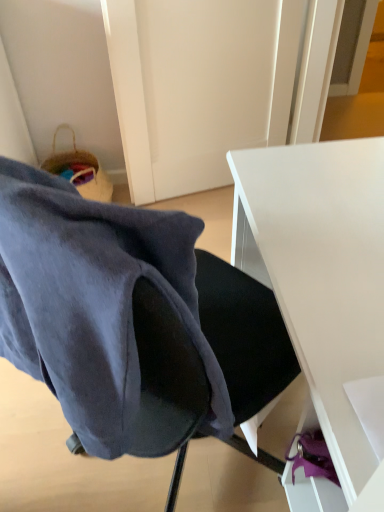
Question: Can you confirm if white matte desk at center is thinner than velvet dark blue chair at center?

Choices:
 (A) yes
 (B) no

Answer: (B)

Question: Would you say white matte desk at center is a long distance from velvet dark blue chair at center?

Choices:
 (A) no
 (B) yes

Answer: (A)

Question: Is white matte desk at center behind velvet dark blue chair at center?

Choices:
 (A) yes
 (B) no

Answer: (A)

Question: Does white matte desk at center turn towards velvet dark blue chair at center?

Choices:
 (A) yes
 (B) no

Answer: (A)

Question: Is white matte desk at center smaller than velvet dark blue chair at center?

Choices:
 (A) yes
 (B) no

Answer: (B)

Question: Considering the relative sizes of white matte desk at center and velvet dark blue chair at center in the image provided, is white matte desk at center wider than velvet dark blue chair at center?

Choices:
 (A) yes
 (B) no

Answer: (A)

Question: Considering the relative positions of velvet dark blue chair at center and white matte desk at center in the image provided, is velvet dark blue chair at center in front of white matte desk at center?

Choices:
 (A) no
 (B) yes

Answer: (B)

Question: From a real-world perspective, is velvet dark blue chair at center physically below white matte desk at center?

Choices:
 (A) yes
 (B) no

Answer: (B)

Question: Does velvet dark blue chair at center lie behind white matte desk at center?

Choices:
 (A) no
 (B) yes

Answer: (A)

Question: Can you confirm if velvet dark blue chair at center is taller than white matte desk at center?

Choices:
 (A) yes
 (B) no

Answer: (B)

Question: From the image's perspective, is velvet dark blue chair at center below white matte desk at center?

Choices:
 (A) yes
 (B) no

Answer: (B)

Question: Is velvet dark blue chair at center outside of white matte desk at center?

Choices:
 (A) yes
 (B) no

Answer: (A)

Question: In terms of width, does velvet dark blue chair at center look wider or thinner when compared to white matte desk at center?

Choices:
 (A) wide
 (B) thin

Answer: (B)